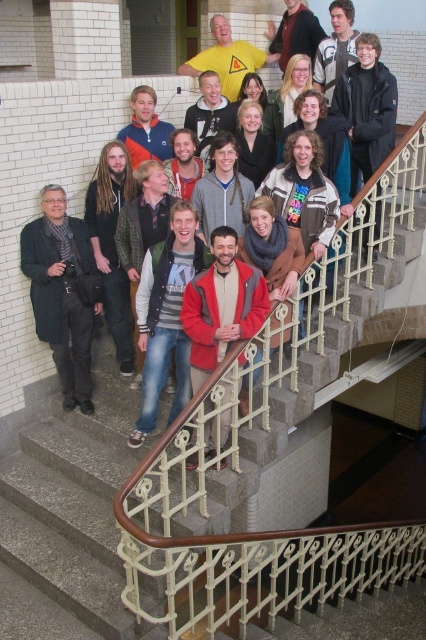
Does dark gray wool coat at left lie behind matte black jacket at upper center?

No.

Can you confirm if dark gray wool coat at left is positioned above matte black jacket at upper center?

Incorrect, dark gray wool coat at left is not positioned above matte black jacket at upper center.

Find the location of a particular element. The image size is (426, 640). dark gray wool coat at left is located at coordinates (62, 292).

Where is `dark gray wool coat at left`? The image size is (426, 640). dark gray wool coat at left is located at coordinates (62, 292).

Does dark gray wool coat at left have a lesser width compared to matte black jacket at center?

Incorrect, dark gray wool coat at left's width is not less than matte black jacket at center's.

Between dark gray wool coat at left and matte black jacket at center, which one appears on the right side from the viewer's perspective?

From the viewer's perspective, matte black jacket at center appears more on the right side.

At what (x,y) coordinates should I click in order to perform the action: click on dark gray wool coat at left. Please return your answer as a coordinate pair (x, y). Looking at the image, I should click on (62, 292).

Where is `dark brown leather jacket at center`? The height and width of the screenshot is (640, 426). dark brown leather jacket at center is located at coordinates (367, 108).

Is dark brown leather jacket at center taller than matte black jacket at center?

Correct, dark brown leather jacket at center is much taller as matte black jacket at center.

At what (x,y) coordinates should I click in order to perform the action: click on dark brown leather jacket at center. Please return your answer as a coordinate pair (x, y). The height and width of the screenshot is (640, 426). Looking at the image, I should click on (367, 108).